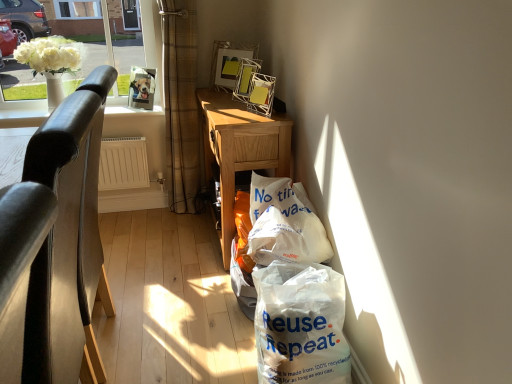
The height and width of the screenshot is (384, 512). In order to click on vacant space underneath black leather chair at left (from a real-world perspective) in this screenshot , I will do `click(111, 342)`.